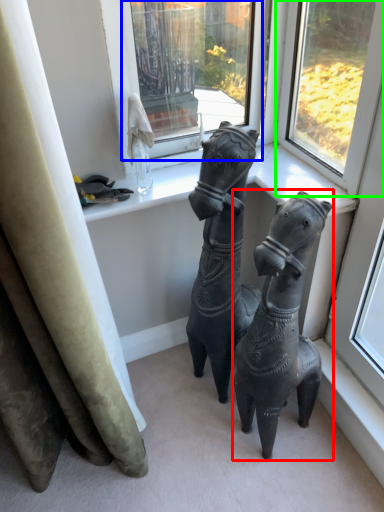
Question: Which object is positioned farthest from horse (highlighted by a red box)? Select from window (highlighted by a blue box) and window (highlighted by a green box).

Choices:
 (A) window
 (B) window

Answer: (A)